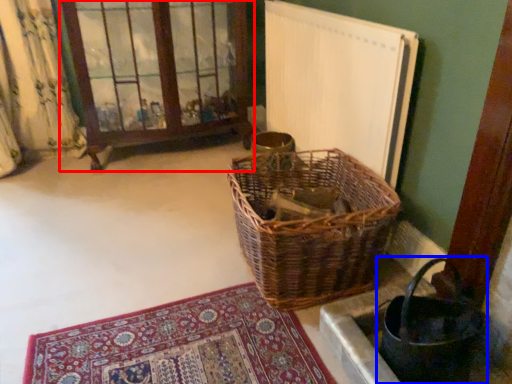
Question: Which object is further to the camera taking this photo, window frame (highlighted by a red box) or basket (highlighted by a blue box)?

Choices:
 (A) window frame
 (B) basket

Answer: (A)